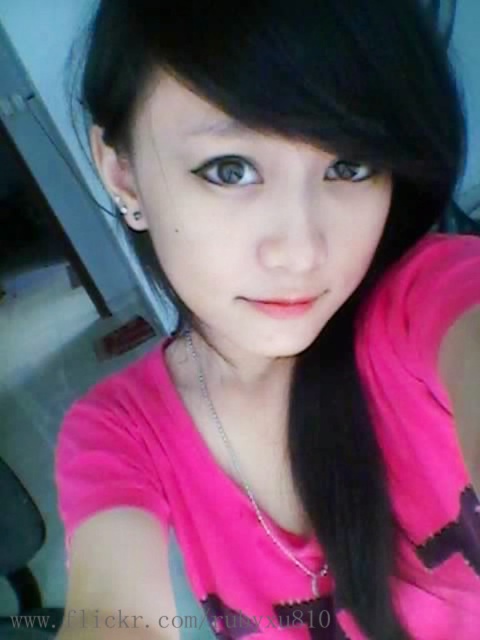
You are taking a selfie and want to ensure your face is in focus. Given that the camera is positioned at point A and your face is at point B, which is located at coordinates point [216,428], what is the minimum focusing distance required to capture your face clearly?

The minimum focusing distance required is 24.70 inches, as the distance between the camera at point A and the face at point [216,428] is 24.70 inches.

Based on the photo, you are holding a smartphone and want to take a selfie. You notice a point at coordinates point (x=212, y=172) in the frame. If your phone requires the subject to be at least 12 inches away to focus properly, is the point within the minimum focusing distance?

The distance of point (x=212, y=172) from viewer is 14.35 inches, so yes, the point is within the minimum focusing distance of 12 inches since it is farther away.

You are holding a camera and want to take a photo of the person in the selfie. The camera has a focus range that can only focus on objects between 20 and 25 inches away. Is the point at coordinates point (300, 570) within the camera focus range?

The point at coordinates point (300, 570) is 24.90 inches from the viewer, which falls within the camera focus range of 20 to 25 inches. Therefore, the camera can focus on this point.